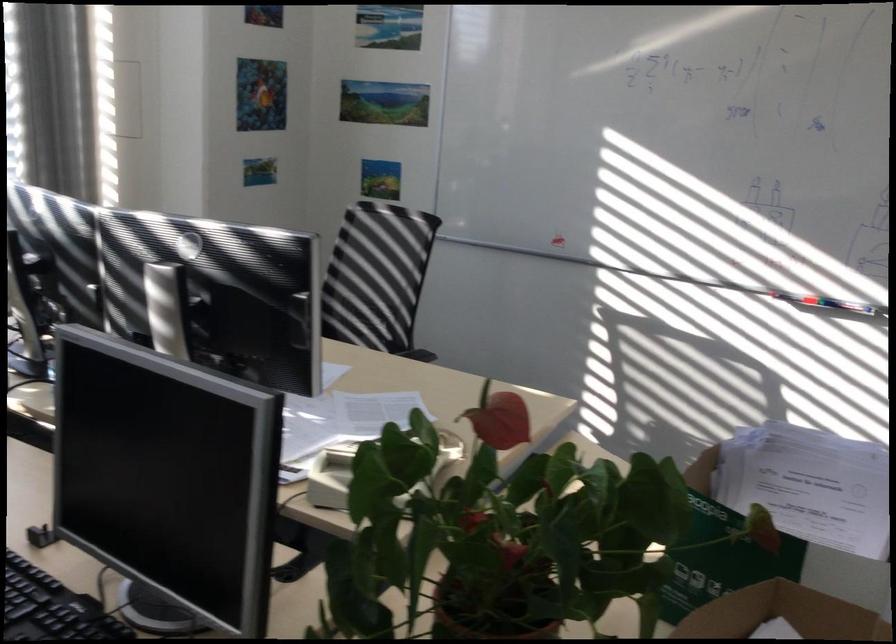
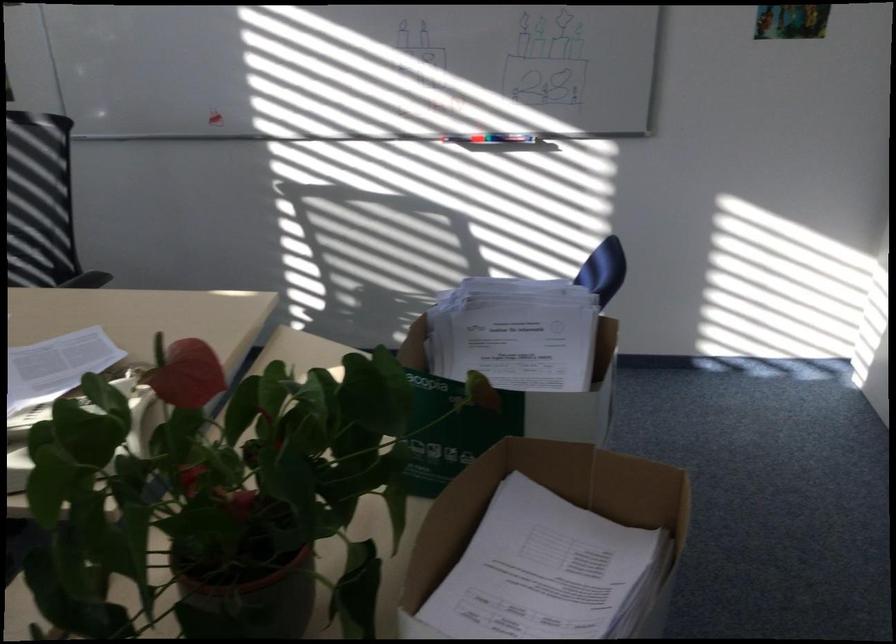
The images are taken continuously from a first-person perspective. In which direction are you moving?

The movement direction of the cameraman is right, forward.